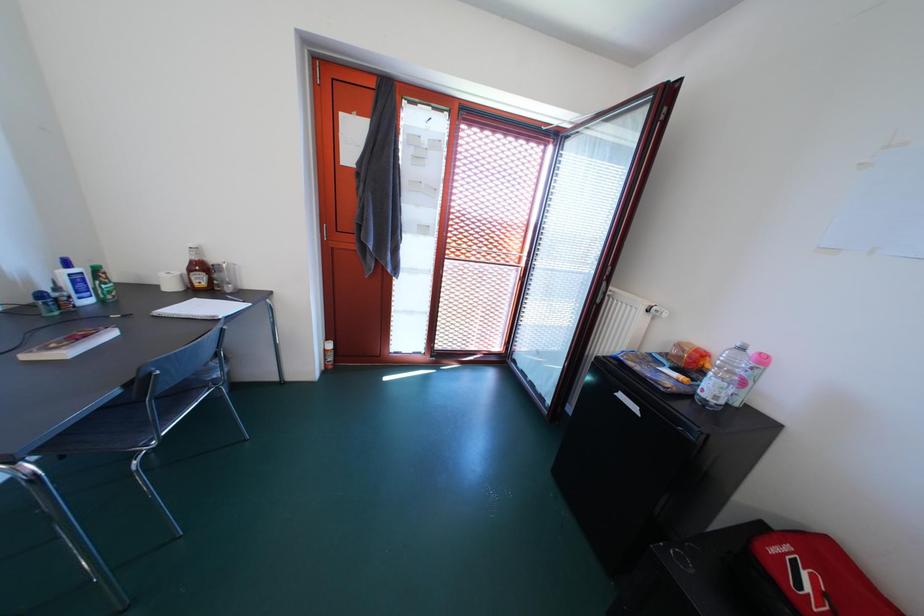
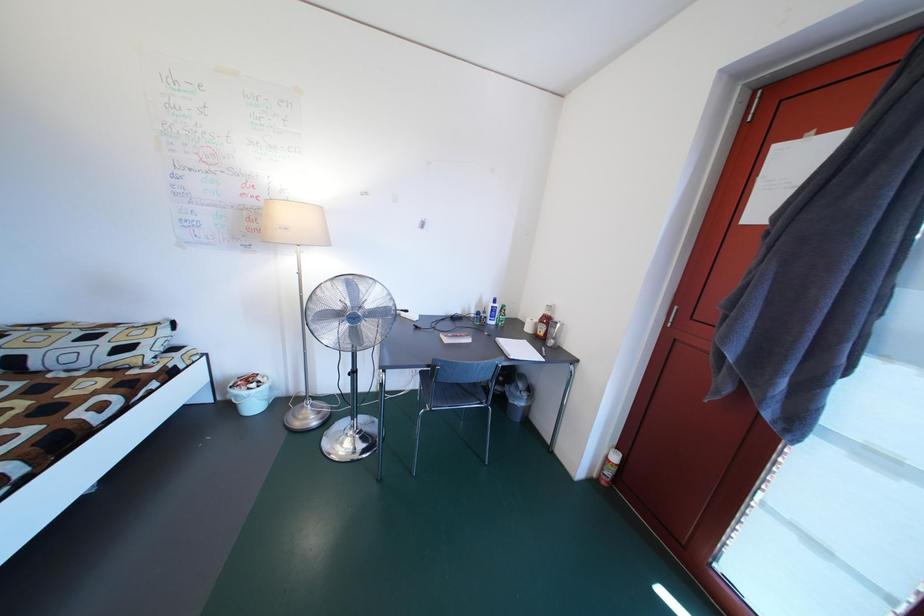
Question: The first image is from the beginning of the video and the second image is from the end. How did the camera likely rotate when shooting the video?

Choices:
 (A) Left
 (B) Right
 (C) Up
 (D) Down

Answer: (A)